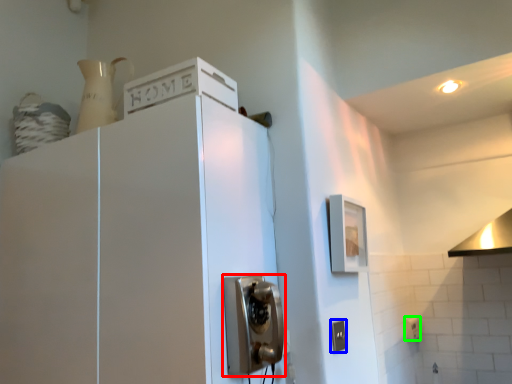
Question: Considering the real-world distances, which object is closest to door handle (highlighted by a red box)? electric outlet (highlighted by a blue box) or electric outlet (highlighted by a green box).

Choices:
 (A) electric outlet
 (B) electric outlet

Answer: (A)